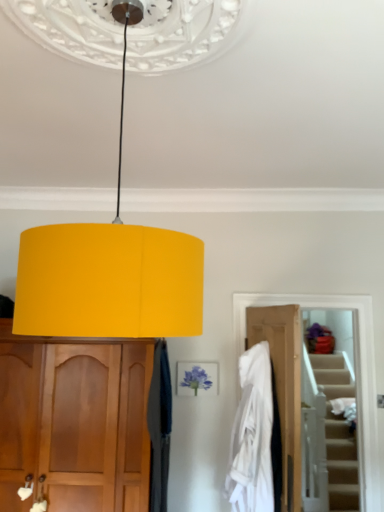
Describe the element at coordinates (159, 426) in the screenshot. This screenshot has width=384, height=512. I see `velvet dark blue curtain at center` at that location.

The width and height of the screenshot is (384, 512). What do you see at coordinates (252, 435) in the screenshot?
I see `white fabric at center` at bounding box center [252, 435].

Find the location of a particular element. The width and height of the screenshot is (384, 512). velvet dark blue curtain at center is located at coordinates (159, 426).

Which is behind, point (62, 495) or point (249, 380)?

The point (249, 380) is more distant.

Which object is wider, matte wood cabinet at left or white fabric at center?

With larger width is matte wood cabinet at left.

Does matte wood cabinet at left have a smaller size compared to white fabric at center?

No, matte wood cabinet at left is not smaller than white fabric at center.

From the image's perspective, which is below, matte wood cabinet at left or white fabric at center?

matte wood cabinet at left.

In the image, is matte yellow lampshade at center positioned in front of or behind wooden door at lower right?

matte yellow lampshade at center is in front of wooden door at lower right.

Considering the positions of points (81, 279) and (362, 418), is point (81, 279) closer to camera compared to point (362, 418)?

That is True.

Is matte yellow lampshade at center oriented away from wooden door at lower right?

No, wooden door at lower right is not at the back of matte yellow lampshade at center.

From the image's perspective, is matte yellow lampshade at center beneath wooden door at lower right?

No, from the image's perspective, matte yellow lampshade at center is not beneath wooden door at lower right.

Is wooden door at lower right taller than white fabric at center?

Yes.

Find the location of a particular element. The height and width of the screenshot is (512, 384). clothing below the wooden door at lower right (from the image's perspective) is located at coordinates (252, 435).

Which of these two, velvet dark blue curtain at center or wooden door at lower right, stands shorter?

Standing shorter between the two is velvet dark blue curtain at center.

Is velvet dark blue curtain at center with wooden door at lower right?

No, velvet dark blue curtain at center is not making contact with wooden door at lower right.

Does velvet dark blue curtain at center appear on the right side of wooden door at lower right?

No.

Is point (154, 321) farther from viewer compared to point (162, 408)?

No, it is in front of (162, 408).

Visually, is matte yellow lampshade at center positioned to the left or to the right of velvet dark blue curtain at center?

From the image, it's evident that matte yellow lampshade at center is to the left of velvet dark blue curtain at center.

Who is more distant, matte yellow lampshade at center or velvet dark blue curtain at center?

velvet dark blue curtain at center is more distant.

Does velvet dark blue curtain at center have a lesser width compared to matte yellow lampshade at center?

Yes.

From a real-world perspective, which is physically above, velvet dark blue curtain at center or matte yellow lampshade at center?

matte yellow lampshade at center, from a real-world perspective.

From the picture: Is velvet dark blue curtain at center at the left side of matte yellow lampshade at center?

No.

Which object is thinner, white fabric at center or matte yellow lampshade at center?

white fabric at center is thinner.

How different are the orientations of white fabric at center and matte yellow lampshade at center in degrees?

They differ by 106 degrees in their facing directions.

Is white fabric at center positioned far away from matte yellow lampshade at center?

Yes, white fabric at center is far from matte yellow lampshade at center.

Considering the positions of points (241, 428) and (127, 258), is point (241, 428) farther from camera compared to point (127, 258)?

Yes.

Locate an element on the screen. Image resolution: width=384 pixels, height=512 pixels. cabinetry above the white fabric at center (from a real-world perspective) is located at coordinates (75, 422).

I want to click on lamp above the wooden door at lower right (from the image's perspective), so click(x=109, y=277).

Looking at the image, which one is located closer to wooden door at lower right, matte wood cabinet at left or velvet dark blue curtain at center?

velvet dark blue curtain at center is positioned closer to the anchor wooden door at lower right.

When comparing their distances from velvet dark blue curtain at center, does matte wood cabinet at left or white fabric at center seem closer?

Based on the image, matte wood cabinet at left appears to be nearer to velvet dark blue curtain at center.

Based on their spatial positions, is velvet dark blue curtain at center or matte wood cabinet at left further from matte yellow lampshade at center?

velvet dark blue curtain at center lies further to matte yellow lampshade at center than the other object.

Based on their spatial positions, is wooden door at lower right or white fabric at center further from matte wood cabinet at left?

wooden door at lower right is positioned further to the anchor matte wood cabinet at left.

Which object lies nearer to the anchor point matte wood cabinet at left, white fabric at center or wooden door at lower right?

white fabric at center lies closer to matte wood cabinet at left than the other object.

From the image, which object appears to be nearer to wooden door at lower right, white fabric at center or matte wood cabinet at left?

The object closer to wooden door at lower right is white fabric at center.

Estimate the real-world distances between objects in this image. Which object is further from matte wood cabinet at left, velvet dark blue curtain at center or white fabric at center?

white fabric at center is further to matte wood cabinet at left.

Considering their positions, is white fabric at center positioned further to matte wood cabinet at left than matte yellow lampshade at center?

The object further to matte wood cabinet at left is matte yellow lampshade at center.

This screenshot has height=512, width=384. What are the coordinates of `cabinetry between matte yellow lampshade at center and velvet dark blue curtain at center along the z-axis` in the screenshot? It's located at (75, 422).

Find the location of a particular element. cabinetry between matte yellow lampshade at center and wooden door at lower right from front to back is located at coordinates (75, 422).

Locate an element on the screen. This screenshot has width=384, height=512. clothing between velvet dark blue curtain at center and wooden door at lower right in the horizontal direction is located at coordinates (252, 435).

Where is `curtain between matte yellow lampshade at center and wooden door at lower right in the front-back direction`? curtain between matte yellow lampshade at center and wooden door at lower right in the front-back direction is located at coordinates (159, 426).